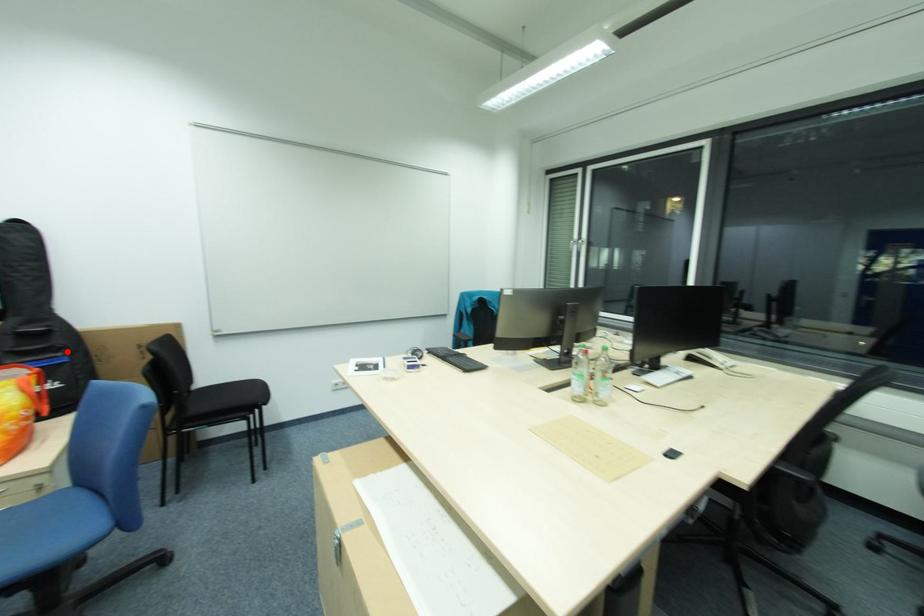
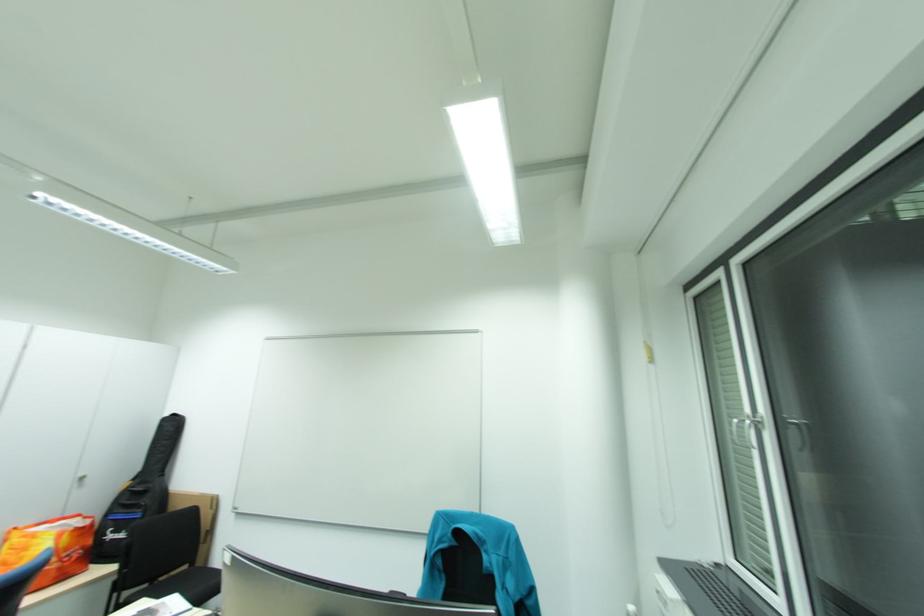
Locate, in the second image, the point that corresponds to the highlighted location in the first image.

(149, 508)